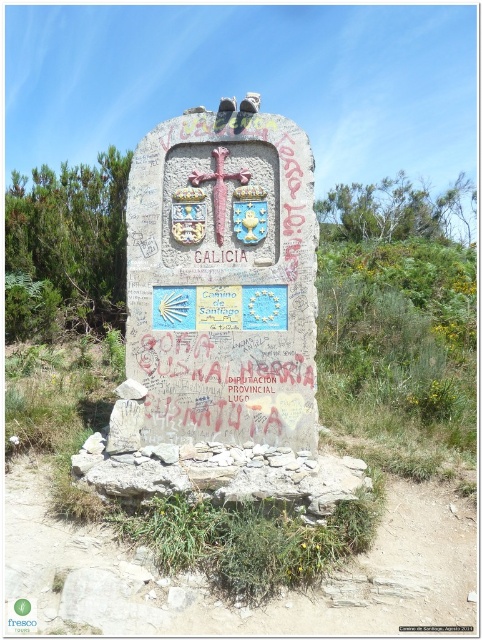
Between stone plaque at center and polished wood cross at center, which one has more height?

Answer: With more height is stone plaque at center.

Measure the distance between point (235, 116) and camera.

They are 12.04 feet apart.

The image size is (482, 640). What do you see at coordinates (224, 276) in the screenshot?
I see `stone plaque at center` at bounding box center [224, 276].

Locate an element on the screen. This screenshot has width=482, height=640. stone plaque at center is located at coordinates (224, 276).